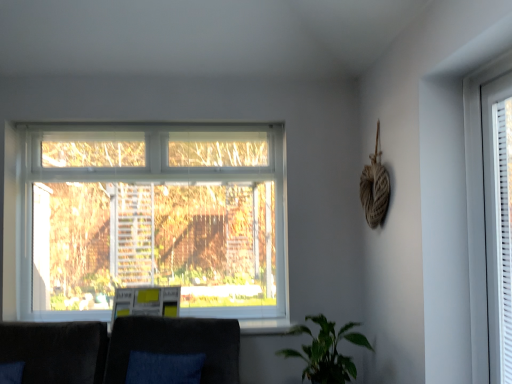
Question: Which is correct: white plastic window at right is inside green matte plant at lower right, or outside of it?

Choices:
 (A) outside
 (B) inside

Answer: (A)

Question: Considering the positions of white plastic window at right and green matte plant at lower right in the image, is white plastic window at right bigger or smaller than green matte plant at lower right?

Choices:
 (A) big
 (B) small

Answer: (B)

Question: Estimate the real-world distances between objects in this image. Which object is closer to the velvet dark gray couch at lower center?

Choices:
 (A) green matte plant at lower right
 (B) white plastic window at right

Answer: (A)

Question: Which of these objects is positioned closest to the velvet dark gray couch at lower center?

Choices:
 (A) white plastic window at right
 (B) green matte plant at lower right

Answer: (B)